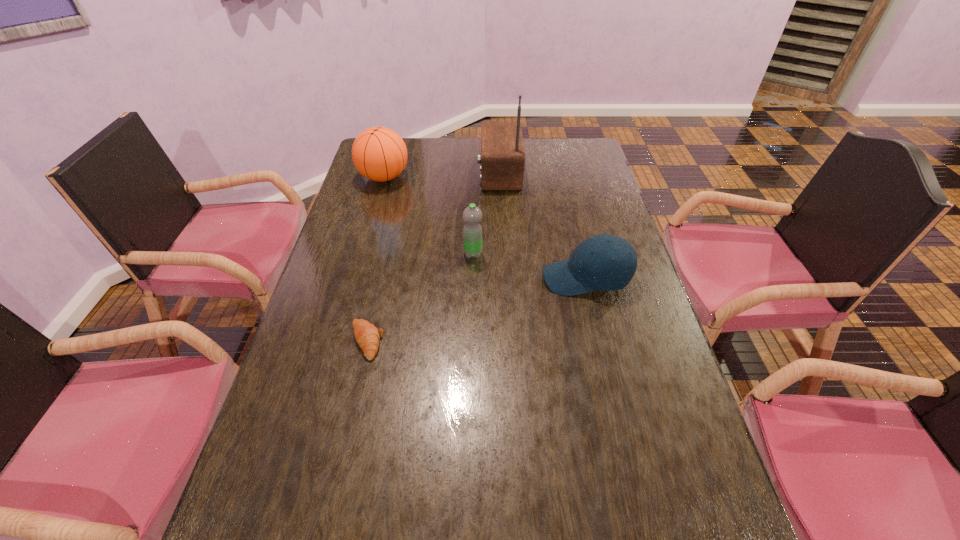
Locate an element on the screen. vacant space that satisfies the following two spatial constraints: 1. on the front-facing side of the radio receiver; 2. on the front side of the basketball is located at coordinates (499, 177).

You are a GUI agent. You are given a task and a screenshot of the screen. Output one action in this format:
    pyautogui.click(x=<x>, y=<y>)
    Task: Click on the vacant region that satisfies the following two spatial constraints: 1. on the front-facing side of the rightmost object; 2. on the front side of the shortest object
    The width and height of the screenshot is (960, 540).
    Given the screenshot: What is the action you would take?
    pyautogui.click(x=601, y=341)

The height and width of the screenshot is (540, 960). In order to click on blank area in the image that satisfies the following two spatial constraints: 1. on the front-facing side of the tallest object; 2. on the front side of the third farthest object in this screenshot , I will do `click(503, 254)`.